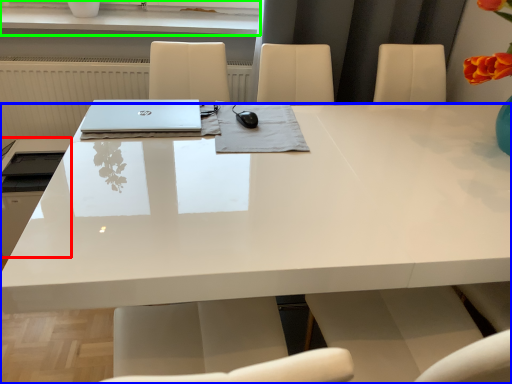
Question: Based on their relative distances, which object is farther from appliance (highlighted by a red box)? Choose from desk (highlighted by a blue box) and window sill (highlighted by a green box).

Choices:
 (A) desk
 (B) window sill

Answer: (B)